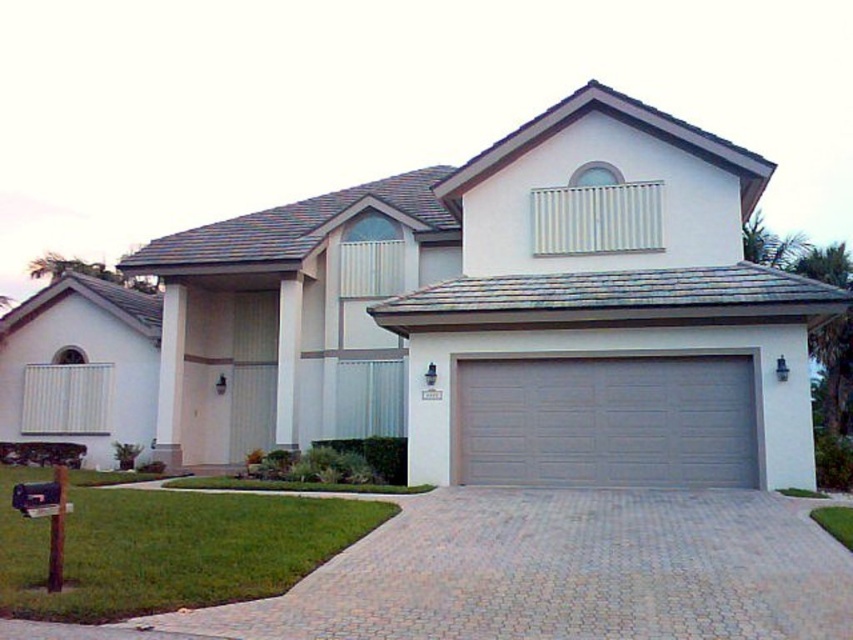
You are a gardener planning to mow the green grass at lower left. To access it, you need to pass through the paved brick driveway at center. Is the driveway on the correct side of the grass to reach it easily?

The paved brick driveway at center is positioned on the right side of green grass at lower left, so yes, the driveway is on the correct side to easily access the grass for mowing.

You are standing in front of the house and want to reach the point at coordinates point (585, 544). If your maximum reach is 10 meters, can you reach it without moving closer?

The point (585, 544) is 9.60 meters from the camera, so yes, you can reach it without moving closer since it is within your 10 meters maximum reach.